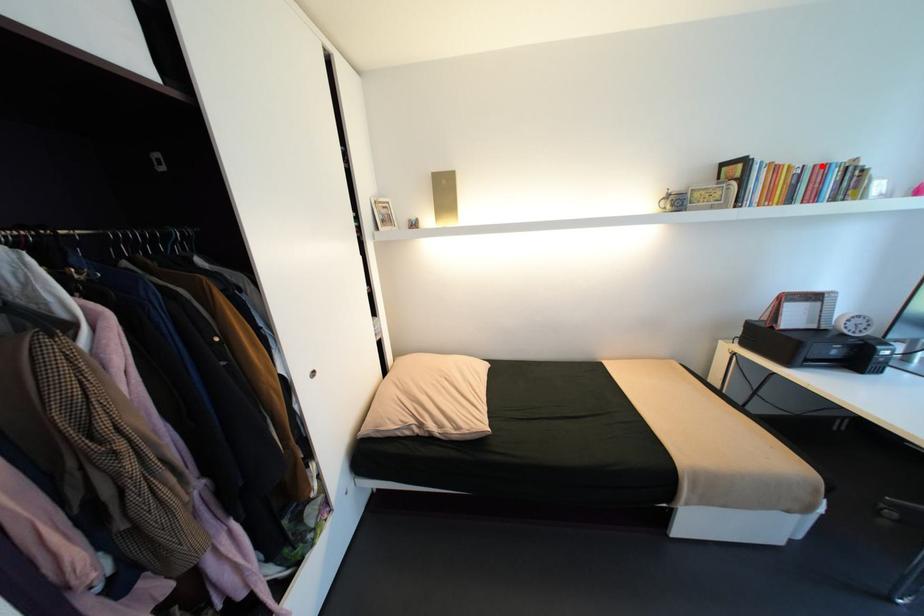
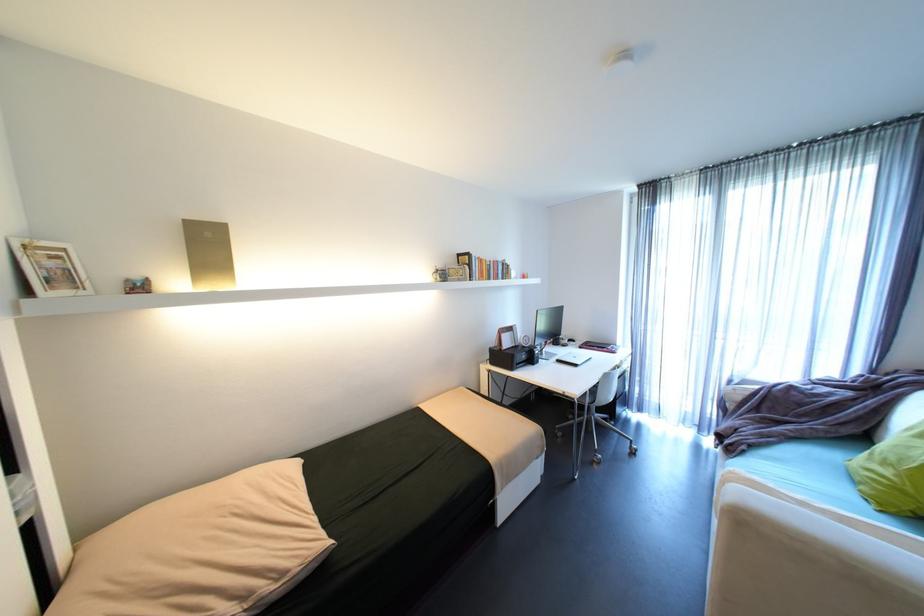
Locate, in the second image, the point that corresponds to the highlighted location in the first image.

(500, 262)